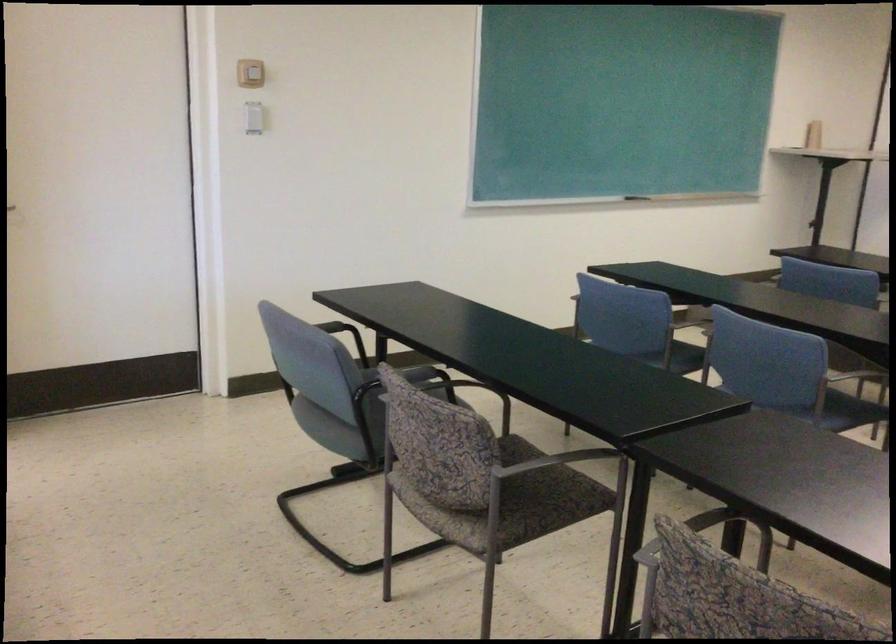
The width and height of the screenshot is (896, 644). I want to click on beige light switch, so click(x=250, y=73).